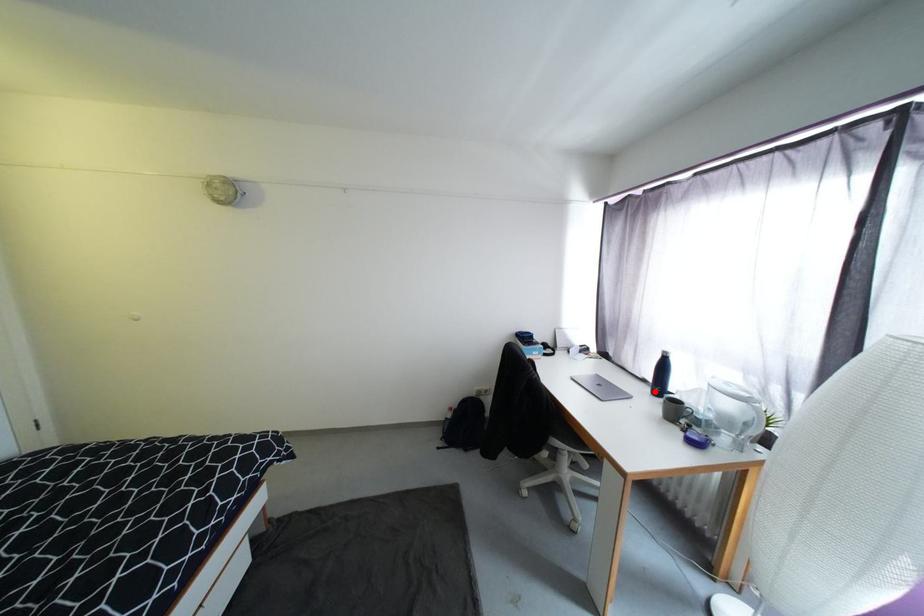
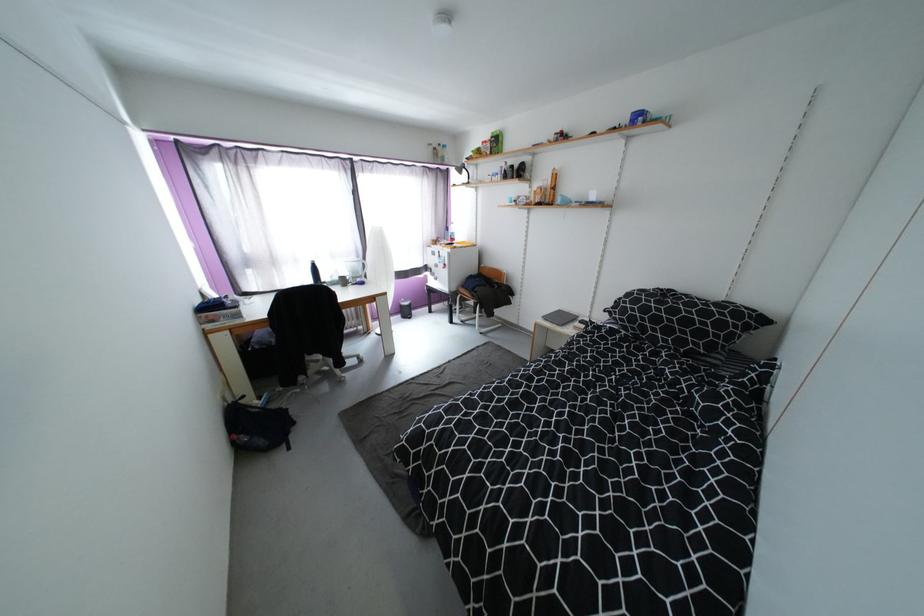
Question: I am providing you with two images of the same scene from different viewpoints. A red point is marked on the first image. Can you still see the location of the red point in image 2?

Choices:
 (A) Yes
 (B) No

Answer: (B)